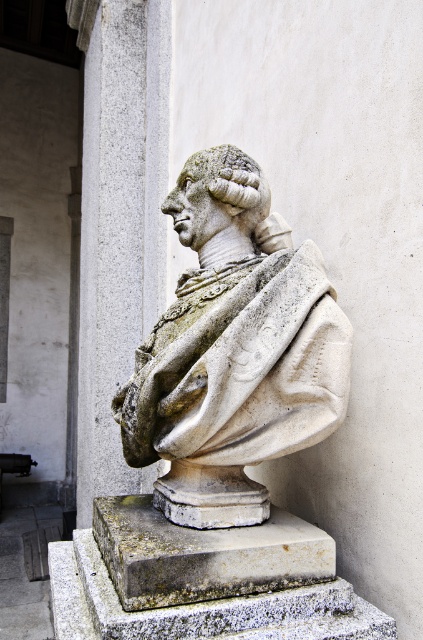
Question: Which of the following is the farthest from the observer?

Choices:
 (A) white stone bust at center
 (B) gray stone column at left

Answer: (B)

Question: Can you confirm if white stone bust at center is thinner than gray stone column at left?

Choices:
 (A) yes
 (B) no

Answer: (A)

Question: Which point is farther from the camera taking this photo?

Choices:
 (A) (98, 113)
 (B) (220, 394)

Answer: (A)

Question: From the image, what is the correct spatial relationship of white stone bust at center in relation to gray stone column at left?

Choices:
 (A) right
 (B) left

Answer: (A)

Question: Is white stone bust at center positioned before gray stone column at left?

Choices:
 (A) yes
 (B) no

Answer: (A)